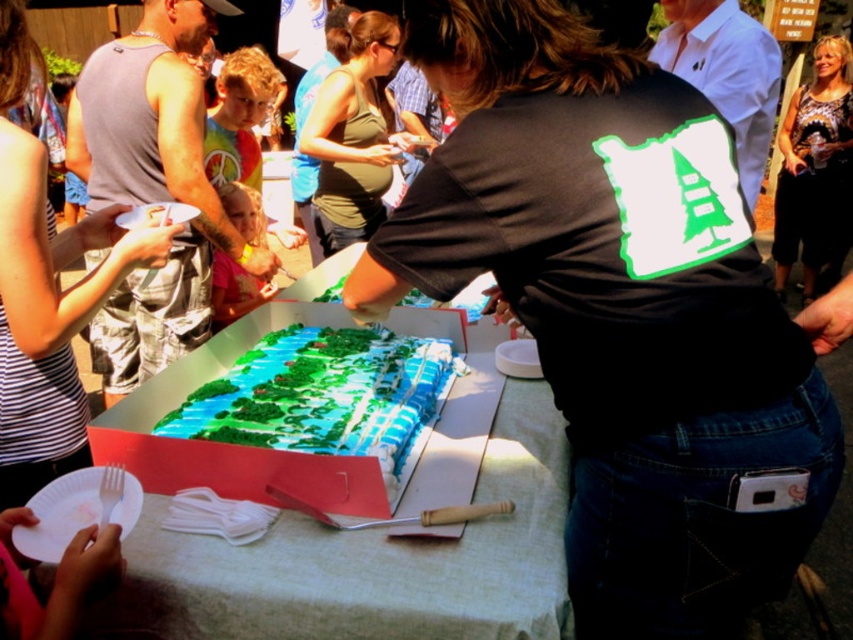
What is the color of the fabric at the point with coordinates (x=45, y=291)?

The point at coordinates (x=45, y=291) corresponds to the striped fabric tank top at left, which has a striped pattern.

You are at a party and want to know if the white paper plate at center can hold a slice of cake from the large rectangular cake on the table. Considering the size of the striped fabric tank top at left, can the plate accommodate the cake slice?

The white paper plate at center is larger in size than the striped fabric tank top at left, so it should be able to accommodate a slice of cake from the large rectangular cake on the table.

In the scene shown: You are at the center of the image and want to place a slice of cake on the white paper plate at center. Based on the coordinates provided, in which direction should you move your hand to reach the plate?

The white paper plate at center is located at coordinates point (380, 547). Since you are at the center of the image, you should move your hand to the right and slightly downward to reach the plate.